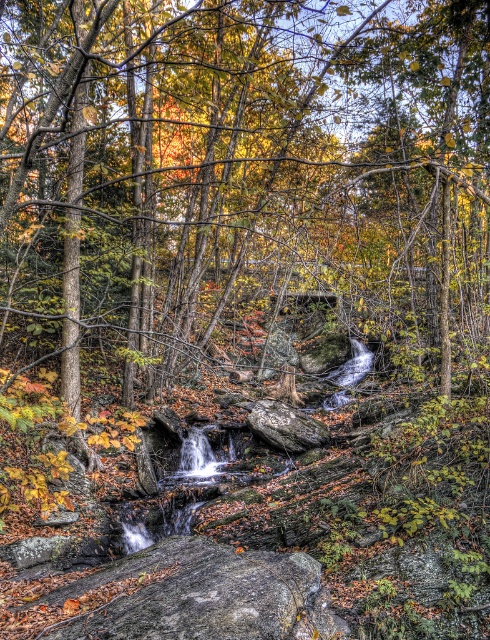
In the scene shown: Can you confirm if gray rough boulder at lower center is thinner than rough gray rock at center?

Incorrect, gray rough boulder at lower center's width is not less than rough gray rock at center's.

Describe the element at coordinates (202, 596) in the screenshot. I see `gray rough boulder at lower center` at that location.

Image resolution: width=490 pixels, height=640 pixels. What are the coordinates of `gray rough boulder at lower center` in the screenshot? It's located at (202, 596).